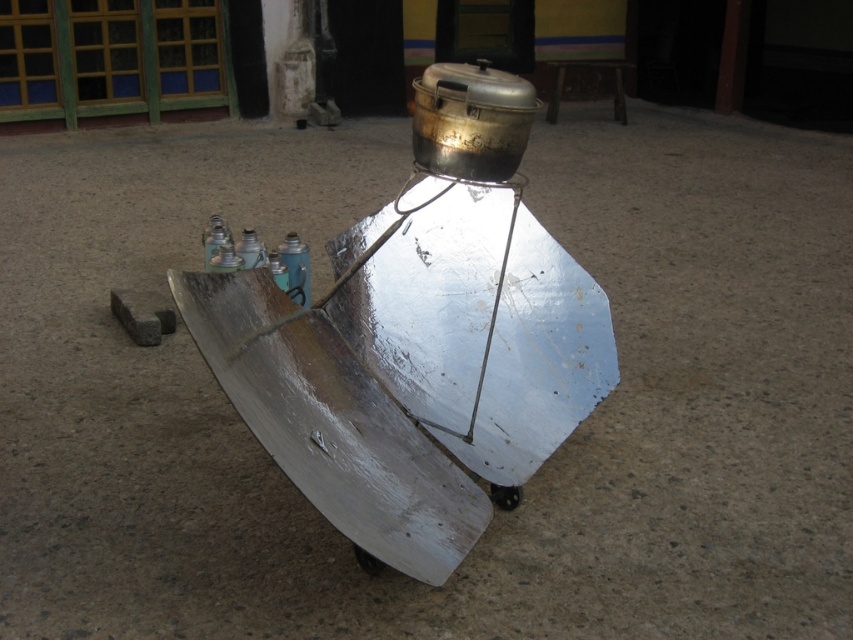
Question: Is brushed metal spray can at center bigger than blue matte bottle at center?

Choices:
 (A) no
 (B) yes

Answer: (B)

Question: Which object appears closest to the camera in this image?

Choices:
 (A) blue matte bottle at center
 (B) brushed metal spray can at center
 (C) blue plastic bottle at center

Answer: (B)

Question: Which object is positioned farthest from the blue plastic bottle at center?

Choices:
 (A) brushed metal spray can at center
 (B) blue matte bottle at center
 (C) matte blue bottle at center

Answer: (A)

Question: Does blue plastic bottle at center have a lesser width compared to brushed metal spray can at center?

Choices:
 (A) yes
 (B) no

Answer: (A)

Question: Is blue plastic bottle at center closer to the viewer compared to matte blue bottle at center?

Choices:
 (A) yes
 (B) no

Answer: (A)

Question: Among these objects, which one is nearest to the camera?

Choices:
 (A) matte blue bottle at center
 (B) brushed metal spray can at center
 (C) blue matte bottle at center

Answer: (B)